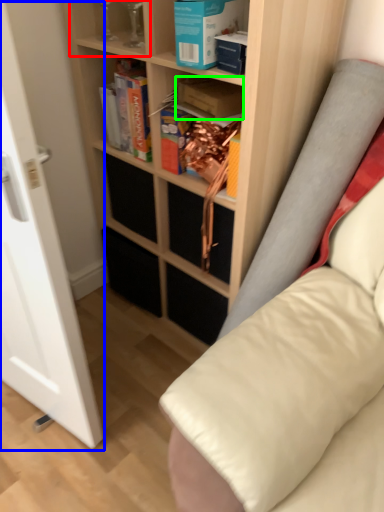
Question: Which is farther away from shelf (highlighted by a red box)? glass door (highlighted by a blue box) or paperback book (highlighted by a green box)?

Choices:
 (A) glass door
 (B) paperback book

Answer: (A)